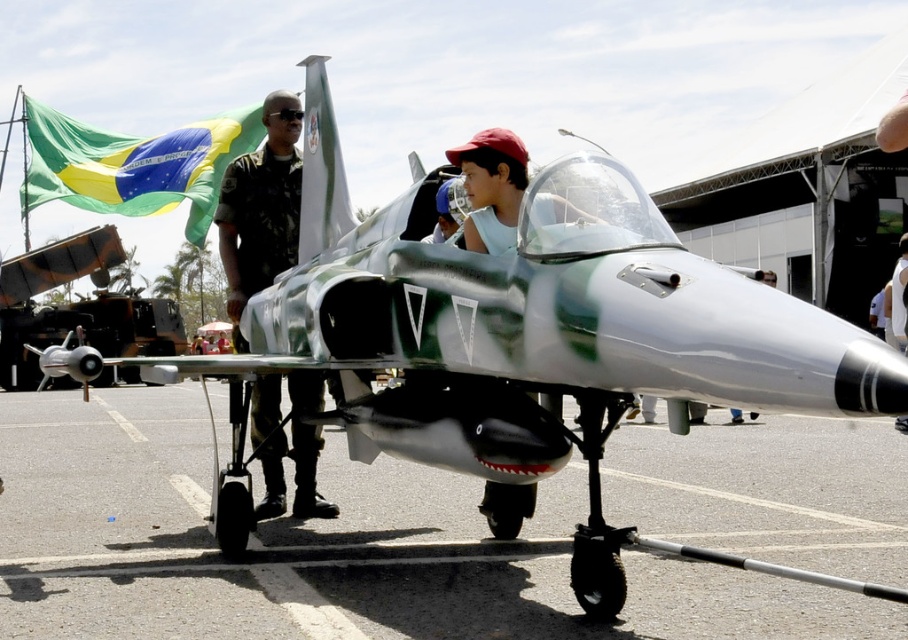
You are a photographer at the airshow. You want to capture a photo that includes both the brushed metal tarmac at lower center and the green fabric flag at upper left. Which object should you focus on first to ensure both are in frame?

You should focus on the brushed metal tarmac at lower center first because it is larger and will require more space in the frame to capture fully, ensuring the smaller green fabric flag at upper left can also be included.

Looking at this image, you are a photographer at the airshow and want to capture both the brushed metal tarmac at lower center and the green fabric flag at upper left in a single shot. Which object should you position closer to the edge of your camera frame to include both?

To include both the brushed metal tarmac at lower center and the green fabric flag at upper left in a single shot, position the green fabric flag at upper left closer to the edge of your camera frame since the brushed metal tarmac at lower center is on the right side of it.

You are at the airshow and want to take a photo of the camouflage uniform at center. Where should you position yourself to capture it in the best light?

The camouflage uniform at center is located at point (260, 209), so position yourself there for optimal lighting.